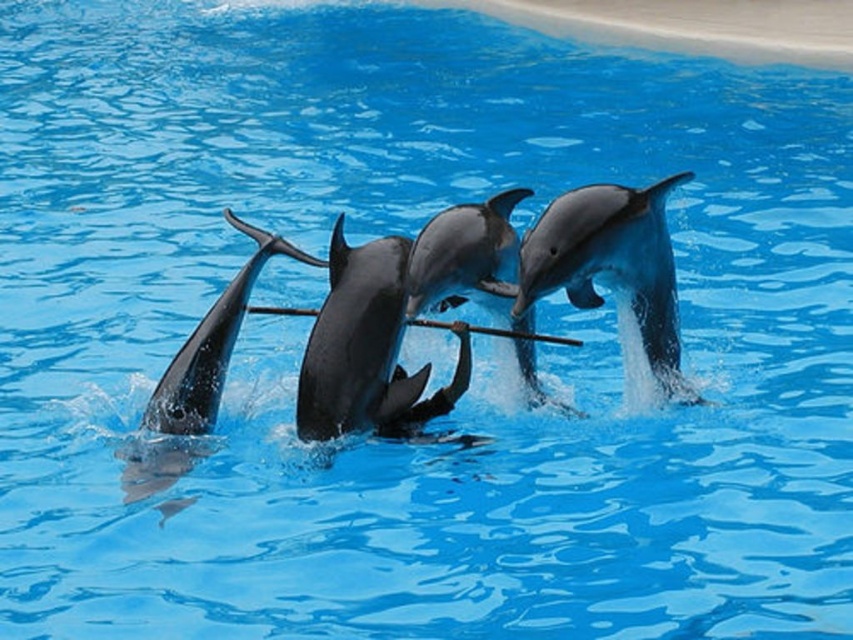
Question: Estimate the real-world distances between objects in this image. Which object is farther from the shiny black dolphin at lower left?

Choices:
 (A) shiny black dolphin at center
 (B) shiny gray dolphin at center

Answer: (B)

Question: From the image, what is the correct spatial relationship of shiny gray dolphin at center in relation to shiny black dolphin at center?

Choices:
 (A) right
 (B) left

Answer: (A)

Question: Which point is farther from the camera taking this photo?

Choices:
 (A) (578, 198)
 (B) (384, 417)

Answer: (B)

Question: Can you confirm if shiny gray dolphin at center is positioned to the left of shiny black dolphin at center?

Choices:
 (A) yes
 (B) no

Answer: (B)

Question: Is the position of shiny black dolphin at center more distant than that of shiny black dolphin at lower left?

Choices:
 (A) yes
 (B) no

Answer: (B)

Question: Which of the following is the farthest from the observer?

Choices:
 (A) shiny black dolphin at lower left
 (B) shiny black dolphin at center
 (C) shiny gray dolphin at center

Answer: (A)